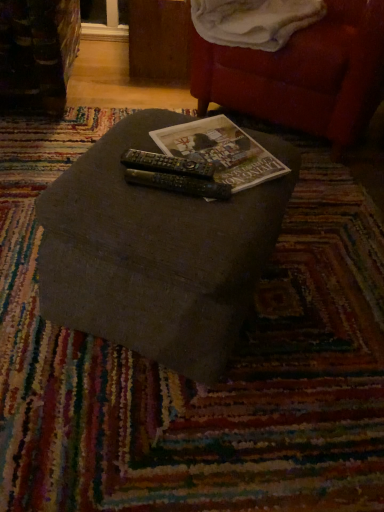
At what (x,y) coordinates should I click in order to perform the action: click on vacant space situated on the left part of black plastic remote at center, the 1th remote in the back-to-front sequence. Please return your answer as a coordinate pair (x, y). The image size is (384, 512). Looking at the image, I should click on (102, 166).